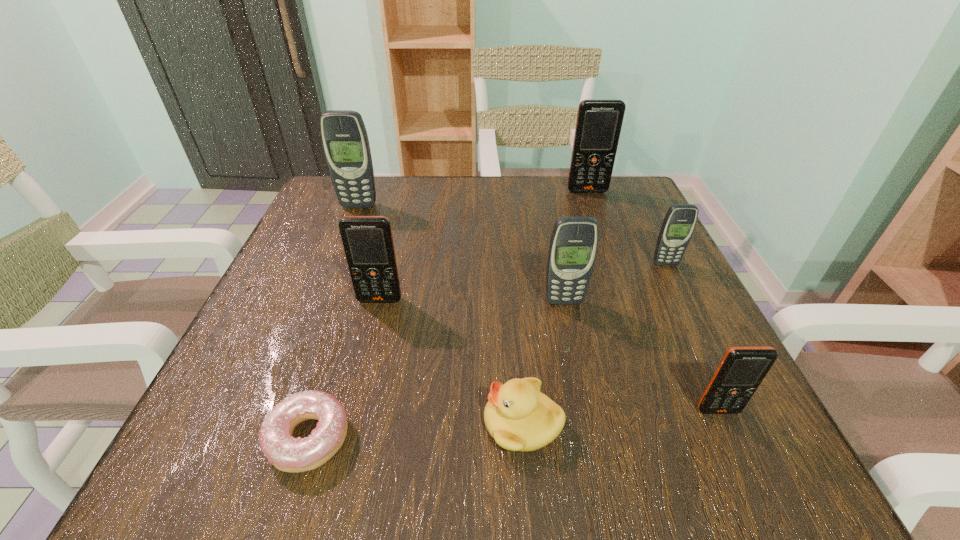
Where is `the rightmost gray cellular telephone`? The width and height of the screenshot is (960, 540). the rightmost gray cellular telephone is located at coordinates (677, 228).

Where is `the second nearest gray cellular telephone`? the second nearest gray cellular telephone is located at coordinates (677, 228).

The width and height of the screenshot is (960, 540). I want to click on yellow duckling, so click(x=519, y=417).

You are a GUI agent. You are given a task and a screenshot of the screen. Output one action in this format:
    pyautogui.click(x=<x>, y=<y>)
    Task: Click on the seventh tallest object
    This screenshot has width=960, height=540.
    Given the screenshot: What is the action you would take?
    pyautogui.click(x=519, y=417)

Find the location of a particular element. The image size is (960, 540). doughnut is located at coordinates (288, 454).

I want to click on pink doughnut, so click(288, 454).

Where is `vacant point located on the screen of the farthest object`? The image size is (960, 540). vacant point located on the screen of the farthest object is located at coordinates (598, 221).

I want to click on free point located on the screen of the biggest gray cellular telephone, so [x=308, y=338].

The width and height of the screenshot is (960, 540). In order to click on vacant space located on the screen of the second smallest gray cellular telephone in this screenshot , I will do (578, 369).

Find the location of a particular element. free space located 0.140m on the screen of the leftmost orange cellular telephone is located at coordinates (364, 367).